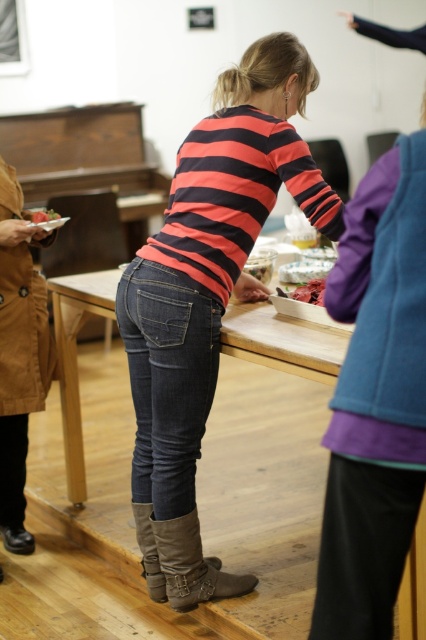
Is striped cotton shirt at center bigger than smooth red plate at center?

Correct, striped cotton shirt at center is larger in size than smooth red plate at center.

Who is higher up, striped cotton shirt at center or smooth red plate at center?

smooth red plate at center is higher up.

Where is `striped cotton shirt at center`? striped cotton shirt at center is located at coordinates [x=376, y=400].

At what (x,y) coordinates should I click in order to perform the action: click on striped cotton shirt at center. Please return your answer as a coordinate pair (x, y). This screenshot has height=640, width=426. Looking at the image, I should click on (376, 400).

Is suede boots at lower center shorter than leather boots at lower center?

No.

Is point (216, 588) positioned before point (146, 515)?

No.

In order to click on suede boots at lower center in this screenshot , I will do `click(192, 564)`.

Which of these two, wooden table at center or suede boots at lower center, stands taller?

wooden table at center is taller.

Can you confirm if wooden table at center is positioned to the right of suede boots at lower center?

In fact, wooden table at center is to the left of suede boots at lower center.

Does point (89, 276) come farther from viewer compared to point (198, 561)?

Yes, point (89, 276) is farther from viewer.

This screenshot has height=640, width=426. What are the coordinates of `wooden table at center` in the screenshot? It's located at (284, 340).